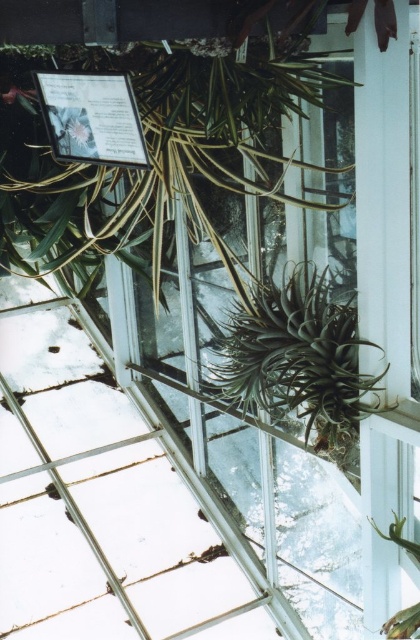
You are a visitor in the greenhouse and want to take a photo of the matte silver plaque at upper left and the green spiky plant at lower right. Which object should you focus on first if you want to capture both in a single frame without moving the camera?

You should focus on the matte silver plaque at upper left first because it is larger in size compared to the green spiky plant at lower right, so it will be more prominent in the frame.

You are a gardener who wants to place a new small cactus in the greenhouse. You see the dark green spiky plant at center and the green spiky plant at lower right. Which plant should you choose to place the cactus near if you want it to have more space to grow?

The dark green spiky plant at center has a larger size compared to the green spiky plant at lower right. Therefore, placing the new small cactus near the green spiky plant at lower right would provide more space for growth since it is smaller.